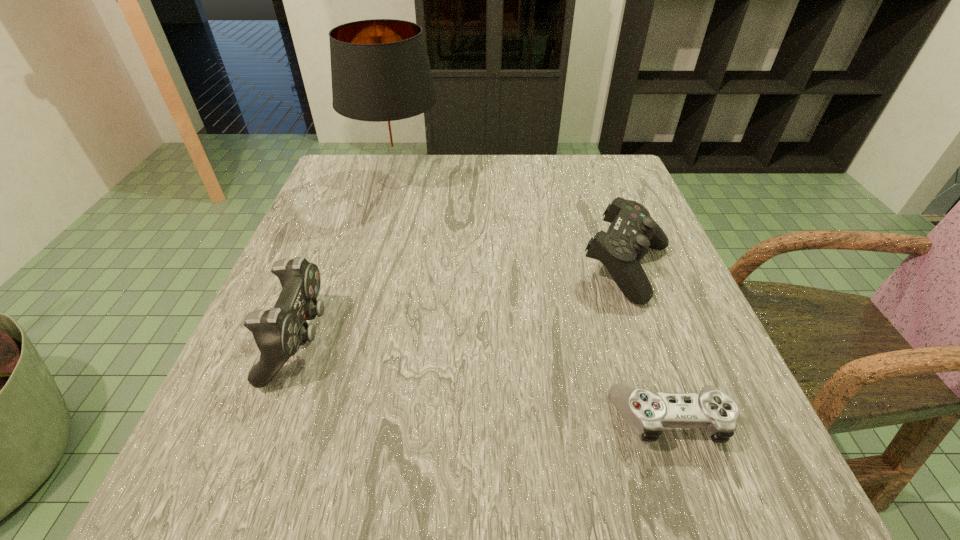
Where is `object present at the far edge`? This screenshot has width=960, height=540. object present at the far edge is located at coordinates (381, 77).

Locate an element on the screen. object that is positioned at the near edge is located at coordinates (647, 412).

Locate an element on the screen. This screenshot has height=540, width=960. lampshade present at the left edge is located at coordinates (381, 77).

Identify the location of control that is at the left edge. (278, 332).

You are a GUI agent. You are given a task and a screenshot of the screen. Output one action in this format:
    pyautogui.click(x=<x>, y=<y>)
    Task: Click on the object at the far left corner
    The image size is (960, 540).
    Given the screenshot: What is the action you would take?
    [381, 77]

The height and width of the screenshot is (540, 960). In order to click on object present at the near right corner in this screenshot , I will do `click(647, 412)`.

Identify the location of free space at the far edge. (538, 181).

The width and height of the screenshot is (960, 540). What are the coordinates of `blank space at the near edge of the desktop` in the screenshot? It's located at (651, 488).

Locate an element on the screen. The image size is (960, 540). free space at the left edge of the desktop is located at coordinates (314, 261).

Identify the location of vacant area at the right edge of the desktop. (623, 362).